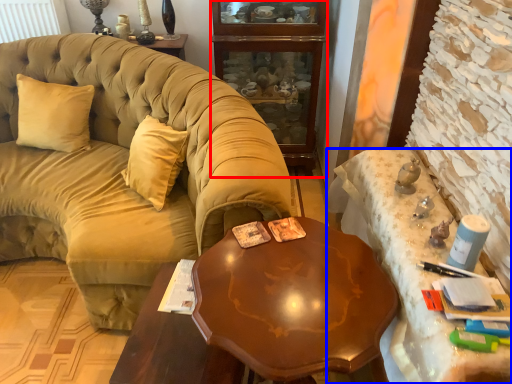
Question: Which object is closer to the camera taking this photo, cabinetry (highlighted by a red box) or desk (highlighted by a blue box)?

Choices:
 (A) cabinetry
 (B) desk

Answer: (B)